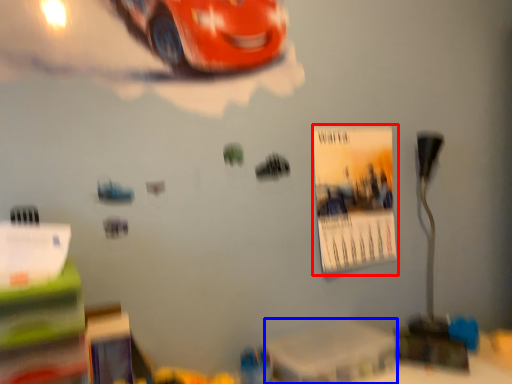
Question: Which point is further to the camera, poster page (highlighted by a red box) or table (highlighted by a blue box)?

Choices:
 (A) poster page
 (B) table

Answer: (A)